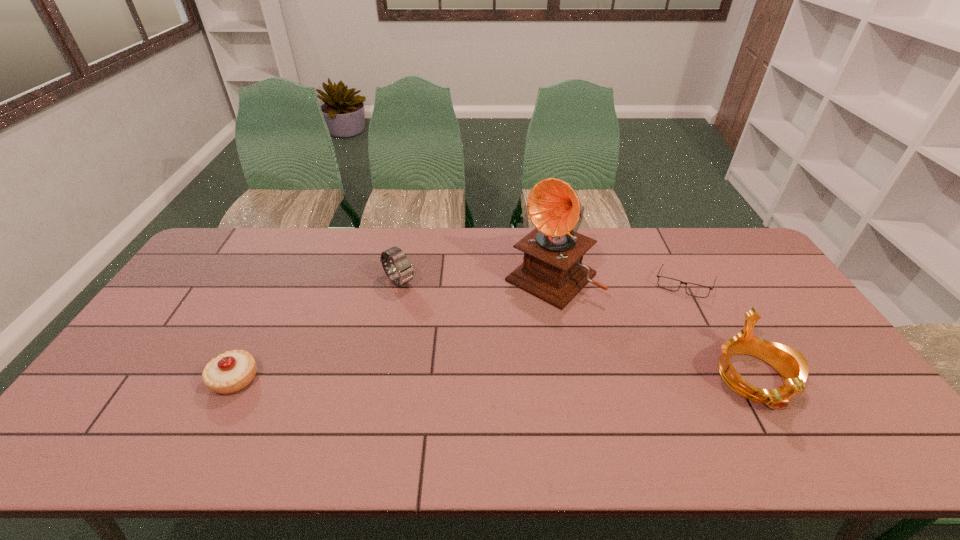
Find the location of a particular element. Image resolution: width=960 pixels, height=540 pixels. vacant space at the near right corner is located at coordinates (856, 396).

Find the location of `free space between the spectacles and the second shortest object`. free space between the spectacles and the second shortest object is located at coordinates (459, 332).

Locate an element on the screen. free space between the shortest object and the tiara is located at coordinates (719, 332).

This screenshot has height=540, width=960. I want to click on free space between the watch and the tallest object, so tap(475, 279).

This screenshot has width=960, height=540. Identify the location of free space that is in between the fourth object from right to left and the leftmost object. (317, 330).

The image size is (960, 540). In order to click on unoccupied area between the tallest object and the second shortest object in this screenshot , I will do `click(393, 328)`.

Identify the location of vacant space that's between the watch and the fourth tallest object. (317, 330).

Where is `vacant area between the pastry and the tiara`? vacant area between the pastry and the tiara is located at coordinates (494, 379).

At what (x,y) coordinates should I click in order to perform the action: click on empty location between the shortest object and the leftmost object. Please return your answer as a coordinate pair (x, y). This screenshot has width=960, height=540. Looking at the image, I should click on (459, 332).

Find the location of a particular element. The width and height of the screenshot is (960, 540). vacant space in between the watch and the tiara is located at coordinates [x=577, y=330].